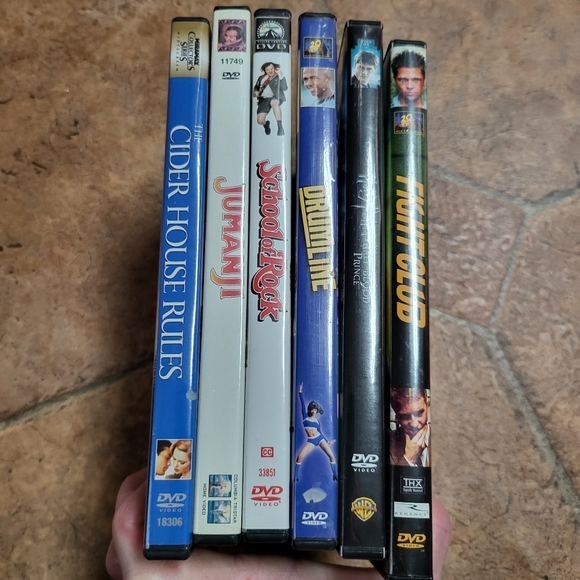
Image resolution: width=580 pixels, height=580 pixels. Identify the location of dvd cases. (414, 242), (365, 245), (327, 238), (269, 237), (230, 237), (169, 238).